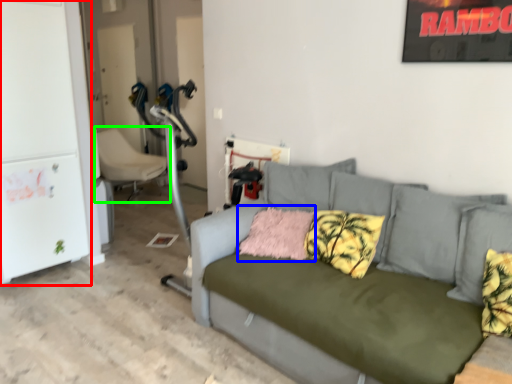
Question: Which object is positioned closest to fridge (highlighted by a red box)? Select from pillow (highlighted by a blue box) and chair (highlighted by a green box).

Choices:
 (A) pillow
 (B) chair

Answer: (B)